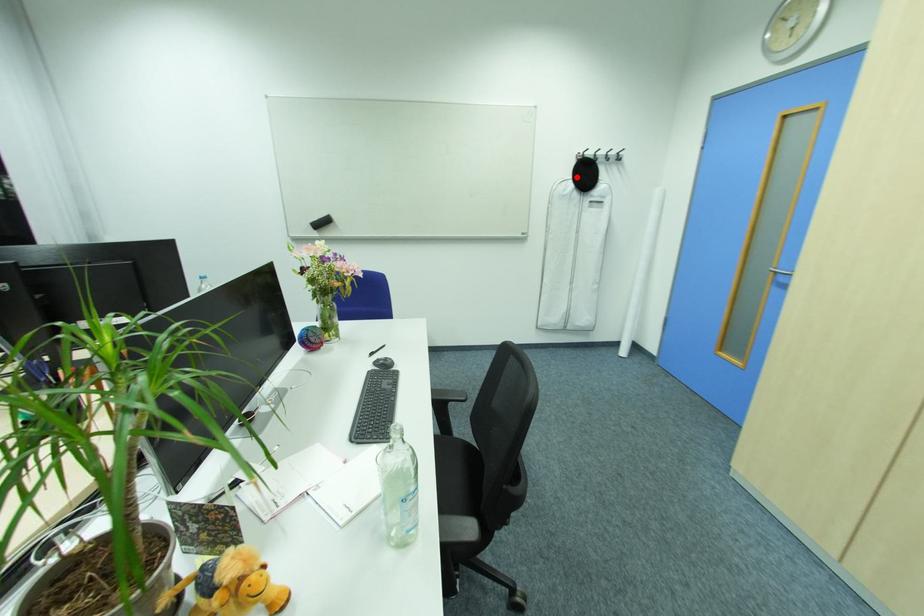
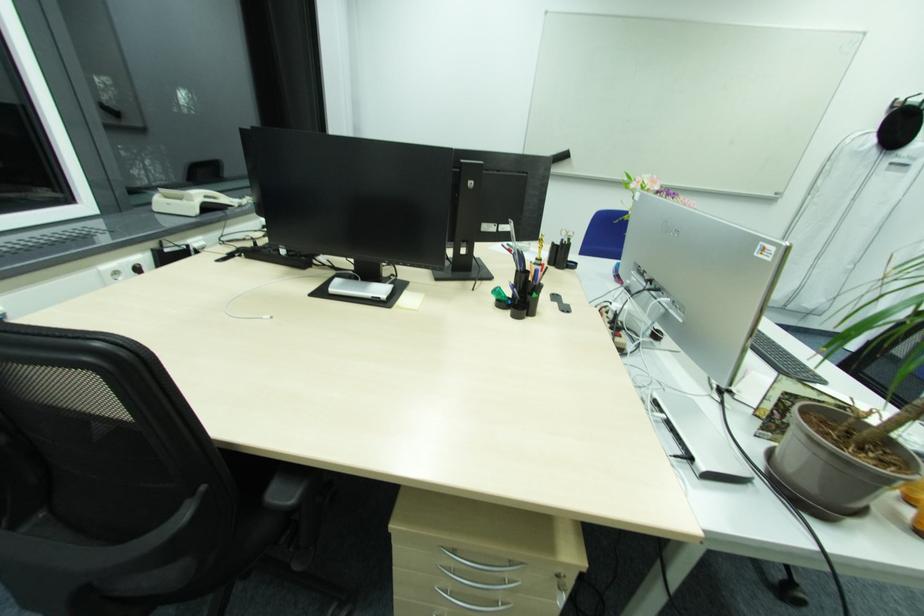
Question: I am providing you with two images of the same scene from different viewpoints. Given a red point in image1, look at the same physical point in image2. Is it:

Choices:
 (A) Closer to the viewpoint
 (B) Farther from the viewpoint

Answer: (B)